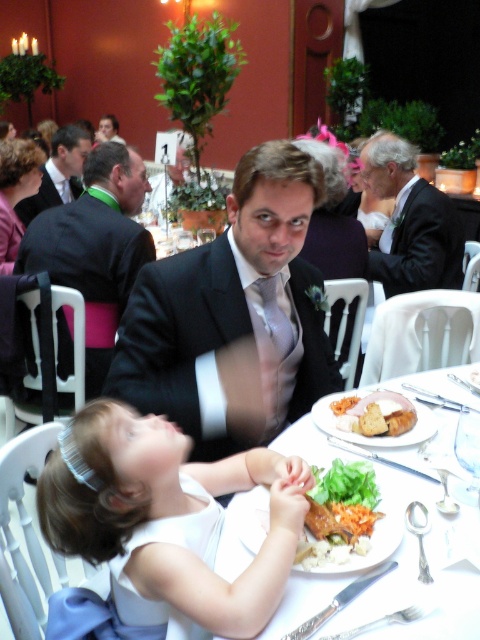
You are standing in the reception hall and want to determine the relative positions of two points marked in the image. Which point, point 1 at coordinates (167, 532) or point 2 at coordinates (104, 134), is closer to you?

Point 1 at coordinates (167, 532) is closer to the viewer than point 2 at coordinates (104, 134).